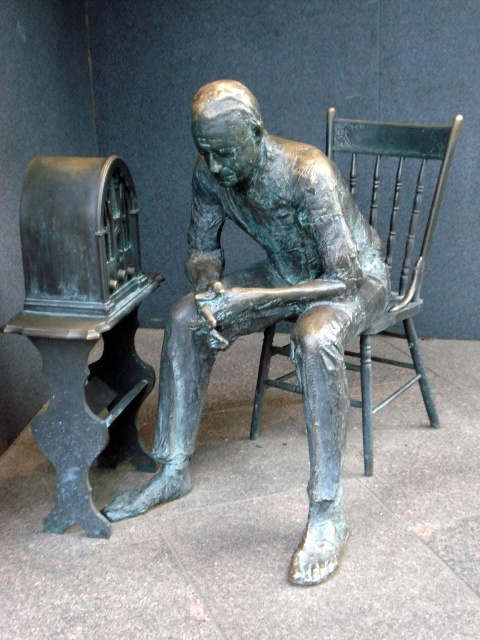
You are standing in front of the bronze statue at center and the green wooden chair at center. Which object is positioned higher in the image?

The green wooden chair at center is positioned higher than the bronze statue at center because the bronze statue at center is located below it.

You are standing in front of the bronze statue at center and the green wooden chair at center. Which object is closer to you?

The bronze statue at center is closer to you because it is in front of the green wooden chair at center.